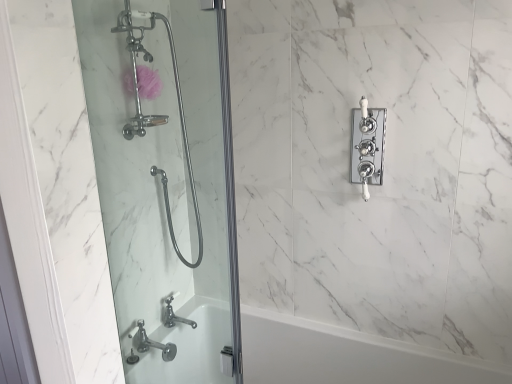
Question: Looking at their shapes, would you say white ceramic faucet at upper right is wider or thinner than clear glass shower door at left?

Choices:
 (A) thin
 (B) wide

Answer: (A)

Question: Considering their positions, is white ceramic faucet at upper right located in front of or behind clear glass shower door at left?

Choices:
 (A) front
 (B) behind

Answer: (B)

Question: Considering the real-world distances, which object is closest to the pink sponge at upper left?

Choices:
 (A) white ceramic faucet at upper right
 (B) white glossy bathtub at lower left
 (C) clear glass shower door at left
 (D) polished chrome faucet at lower left

Answer: (C)

Question: Estimate the real-world distances between objects in this image. Which object is farther from the polished chrome faucet at lower left?

Choices:
 (A) white ceramic faucet at upper right
 (B) pink sponge at upper left
 (C) white glossy bathtub at lower left
 (D) clear glass shower door at left

Answer: (A)